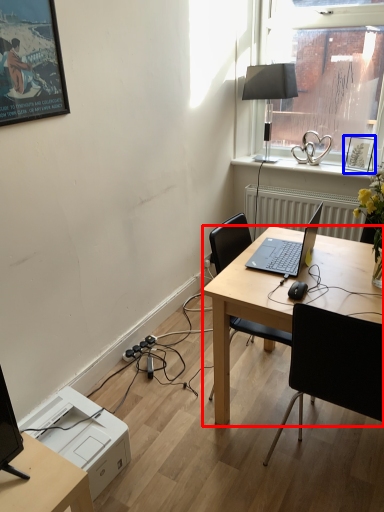
Question: Which object appears farthest to the camera in this image, desk (highlighted by a red box) or picture frame (highlighted by a blue box)?

Choices:
 (A) desk
 (B) picture frame

Answer: (B)